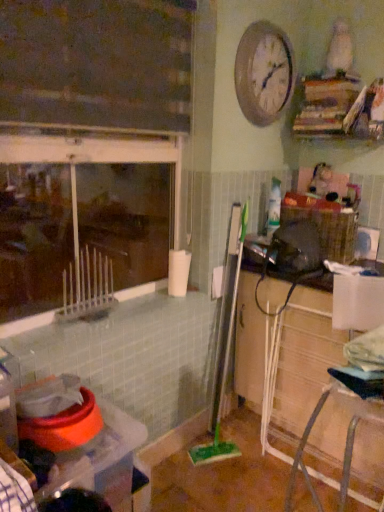
Question: Does wooden cabinet at lower right have a smaller size compared to green plastic brush at center?

Choices:
 (A) no
 (B) yes

Answer: (A)

Question: Can you confirm if wooden cabinet at lower right is taller than green plastic brush at center?

Choices:
 (A) yes
 (B) no

Answer: (B)

Question: Is the position of wooden cabinet at lower right less distant than that of green plastic brush at center?

Choices:
 (A) no
 (B) yes

Answer: (B)

Question: Is wooden cabinet at lower right not near green plastic brush at center?

Choices:
 (A) yes
 (B) no

Answer: (B)

Question: From a real-world perspective, is wooden cabinet at lower right positioned over green plastic brush at center based on gravity?

Choices:
 (A) yes
 (B) no

Answer: (B)

Question: Is wooden cabinet at lower right bigger or smaller than metallic silver clock at upper center?

Choices:
 (A) small
 (B) big

Answer: (B)

Question: From a real-world perspective, is wooden cabinet at lower right above or below metallic silver clock at upper center?

Choices:
 (A) above
 (B) below

Answer: (B)

Question: Would you say wooden cabinet at lower right is to the left or to the right of metallic silver clock at upper center in the picture?

Choices:
 (A) right
 (B) left

Answer: (A)

Question: Considering the positions of wooden cabinet at lower right and metallic silver clock at upper center in the image, is wooden cabinet at lower right taller or shorter than metallic silver clock at upper center?

Choices:
 (A) short
 (B) tall

Answer: (B)

Question: From a real-world perspective, relative to woven brown basket at right, is green plastic brush at center vertically above or below?

Choices:
 (A) above
 (B) below

Answer: (B)

Question: Relative to woven brown basket at right, is green plastic brush at center in front or behind?

Choices:
 (A) behind
 (B) front

Answer: (B)

Question: Looking at the image, does green plastic brush at center seem bigger or smaller compared to woven brown basket at right?

Choices:
 (A) big
 (B) small

Answer: (B)

Question: Which is correct: green plastic brush at center is inside woven brown basket at right, or outside of it?

Choices:
 (A) outside
 (B) inside

Answer: (A)

Question: Is metallic silver clock at upper center taller or shorter than woven brown basket at right?

Choices:
 (A) short
 (B) tall

Answer: (B)

Question: From the image's perspective, relative to woven brown basket at right, is metallic silver clock at upper center above or below?

Choices:
 (A) above
 (B) below

Answer: (A)